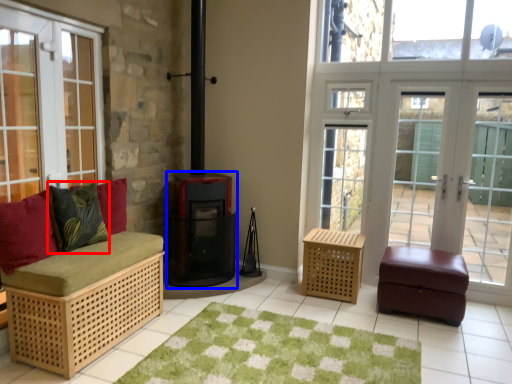
Question: Which of the following is the farthest to the observer, pillow (highlighted by a red box) or wood burning stove (highlighted by a blue box)?

Choices:
 (A) pillow
 (B) wood burning stove

Answer: (B)